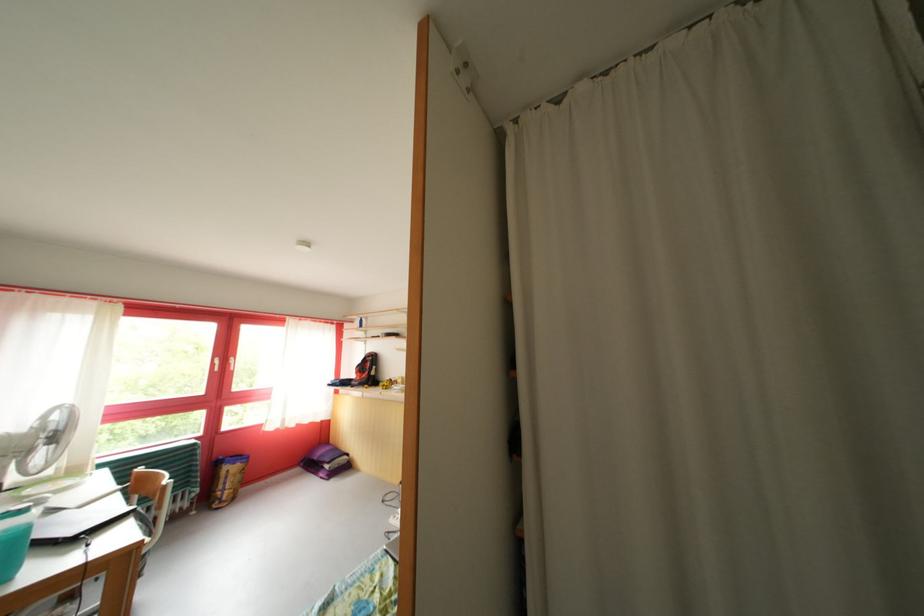
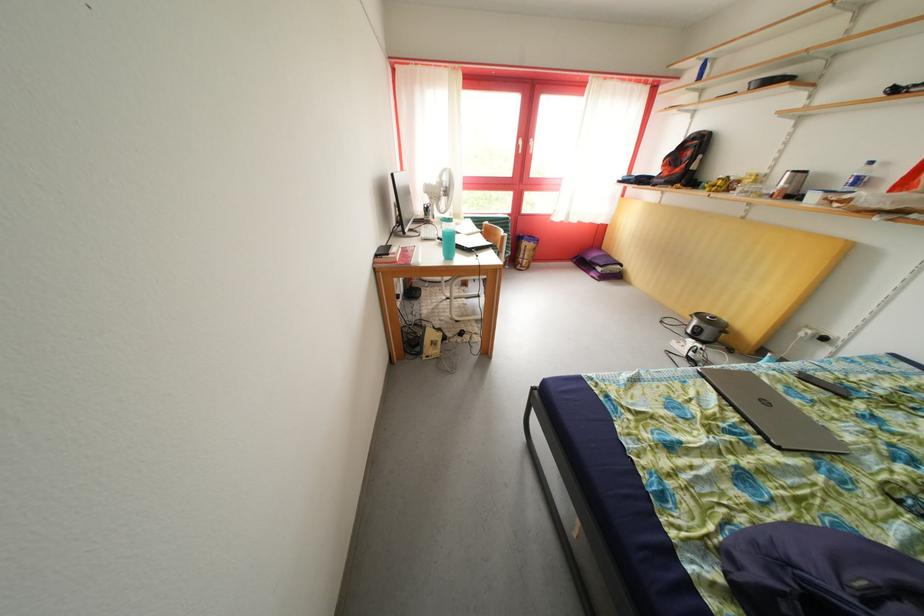
Where in the second image is the point corresponding to (x=38, y=456) from the first image?

(446, 204)